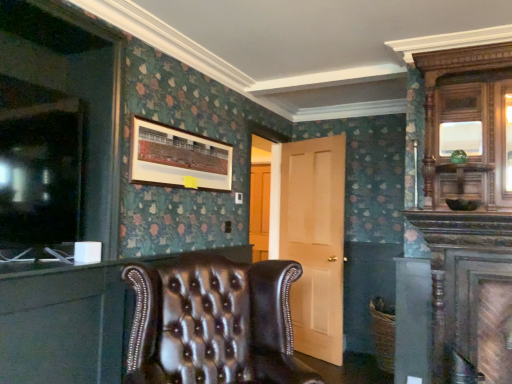
What do you see at coordinates (213, 323) in the screenshot? This screenshot has height=384, width=512. I see `leather tufted chair at center` at bounding box center [213, 323].

Find the location of a particular element. The image size is (512, 384). leather tufted chair at lower left is located at coordinates (67, 323).

Measure the distance between light wood door at center and camera.

The depth of light wood door at center is 3.57 meters.

This screenshot has height=384, width=512. Describe the element at coordinates (452, 73) in the screenshot. I see `polished wood armoire at upper right` at that location.

The image size is (512, 384). What are the coordinates of `leather tufted chair at center` in the screenshot? It's located at (213, 323).

Is polished wood armoire at upper right touching leather tufted chair at lower left?

polished wood armoire at upper right and leather tufted chair at lower left are clearly separated.

Is polished wood armoire at upper right wider than leather tufted chair at lower left?

Correct, the width of polished wood armoire at upper right exceeds that of leather tufted chair at lower left.

You are a GUI agent. You are given a task and a screenshot of the screen. Output one action in this format:
    pyautogui.click(x=<x>, y=<y>)
    Task: Click on the dresser that is under the polished wood armoire at upper right (from a real-world perspective)
    
    Given the screenshot: What is the action you would take?
    pyautogui.click(x=67, y=323)

From a real-world perspective, relative to leather tufted chair at lower left, is polished wood armoire at upper right vertically above or below?

Clearly, from a real-world perspective, polished wood armoire at upper right is above leather tufted chair at lower left.

Is leather tufted chair at center not within matte wooden picture frame at upper center?

Absolutely, leather tufted chair at center is external to matte wooden picture frame at upper center.

Is leather tufted chair at center at the left side of matte wooden picture frame at upper center?

Incorrect, leather tufted chair at center is not on the left side of matte wooden picture frame at upper center.

Which object is thinner, leather tufted chair at center or matte wooden picture frame at upper center?

matte wooden picture frame at upper center is thinner.

Where is `chair below the matte wooden picture frame at upper center (from a real-world perspective)`? chair below the matte wooden picture frame at upper center (from a real-world perspective) is located at coordinates (213, 323).

From the image's perspective, which is below, matte wooden picture frame at upper center or leather tufted chair at center?

leather tufted chair at center is shown below in the image.

How distant is matte wooden picture frame at upper center from leather tufted chair at center?

They are 31.71 inches apart.

What's the angular difference between leather tufted chair at lower left and polished wood armoire at upper right's facing directions?

The angle between the facing direction of leather tufted chair at lower left and the facing direction of polished wood armoire at upper right is 88.9 degrees.

Does leather tufted chair at lower left have a smaller size compared to polished wood armoire at upper right?

Yes.

Is leather tufted chair at lower left looking in the opposite direction of polished wood armoire at upper right?

That's not correct — leather tufted chair at lower left is not looking away from polished wood armoire at upper right.

Which of these two, leather tufted chair at lower left or polished wood armoire at upper right, stands shorter?

leather tufted chair at lower left.

From the picture: Would you say leather tufted chair at center is outside polished wood armoire at upper right?

leather tufted chair at center lies outside polished wood armoire at upper right's area.

Considering the relative sizes of leather tufted chair at center and polished wood armoire at upper right in the image provided, is leather tufted chair at center smaller than polished wood armoire at upper right?

No.

Which is in front, point (131, 344) or point (426, 58)?

The point (131, 344) is closer to the camera.

I want to click on armoire to the right of leather tufted chair at center, so click(452, 73).

Can you confirm if light wood door at center is taller than leather tufted chair at center?

Yes.

Considering the sizes of light wood door at center and leather tufted chair at center in the image, is light wood door at center bigger or smaller than leather tufted chair at center?

Clearly, light wood door at center is smaller in size than leather tufted chair at center.

How many degrees apart are the facing directions of light wood door at center and leather tufted chair at center?

They differ by 69.6 degrees in their facing directions.

Is leather tufted chair at center at the back of light wood door at center?

No, light wood door at center is not facing the opposite direction of leather tufted chair at center.

Considering their positions, is leather tufted chair at lower left located in front of or behind leather tufted chair at center?

Clearly, leather tufted chair at lower left is behind leather tufted chair at center.

From the image's perspective, which is below, leather tufted chair at lower left or leather tufted chair at center?

leather tufted chair at center.

Where is `armoire located above the leather tufted chair at lower left (from a real-world perspective)`? Image resolution: width=512 pixels, height=384 pixels. armoire located above the leather tufted chair at lower left (from a real-world perspective) is located at coordinates (452, 73).

This screenshot has width=512, height=384. Find the location of `chair located below the matte wooden picture frame at upper center (from the image's perspective)`. chair located below the matte wooden picture frame at upper center (from the image's perspective) is located at coordinates (213, 323).

Based on their spatial positions, is leather tufted chair at lower left or matte wooden picture frame at upper center further from light wood door at center?

leather tufted chair at lower left.

When comparing their distances from leather tufted chair at center, does leather tufted chair at lower left or light wood door at center seem closer?

Among the two, leather tufted chair at lower left is located nearer to leather tufted chair at center.

Based on the photo, looking at the image, which one is located further to leather tufted chair at center, polished wood armoire at upper right or light wood door at center?

light wood door at center lies further to leather tufted chair at center than the other object.

Estimate the real-world distances between objects in this image. Which object is closer to leather tufted chair at lower left, polished wood armoire at upper right or matte wooden picture frame at upper center?

matte wooden picture frame at upper center is closer to leather tufted chair at lower left.

Looking at the image, which one is located closer to light wood door at center, matte wooden picture frame at upper center or leather tufted chair at lower left?

matte wooden picture frame at upper center lies closer to light wood door at center than the other object.

Based on their spatial positions, is polished wood armoire at upper right or leather tufted chair at center closer to leather tufted chair at lower left?

Based on the image, leather tufted chair at center appears to be nearer to leather tufted chair at lower left.

From the image, which object appears to be nearer to matte wooden picture frame at upper center, leather tufted chair at center or light wood door at center?

leather tufted chair at center is positioned closer to the anchor matte wooden picture frame at upper center.

Which object lies further to the anchor point polished wood armoire at upper right, light wood door at center or leather tufted chair at lower left?

Based on the image, leather tufted chair at lower left appears to be further to polished wood armoire at upper right.

Find the location of a particular element. The height and width of the screenshot is (384, 512). picture frame between leather tufted chair at lower left and light wood door at center in the front-back direction is located at coordinates (178, 158).

Where is `picture frame between leather tufted chair at lower left and polished wood armoire at upper right from left to right`? This screenshot has height=384, width=512. picture frame between leather tufted chair at lower left and polished wood armoire at upper right from left to right is located at coordinates (178, 158).

The height and width of the screenshot is (384, 512). In order to click on dresser between matte wooden picture frame at upper center and leather tufted chair at center from top to bottom in this screenshot , I will do `click(67, 323)`.

Where is `chair between matte wooden picture frame at upper center and polished wood armoire at upper right in the horizontal direction`? chair between matte wooden picture frame at upper center and polished wood armoire at upper right in the horizontal direction is located at coordinates (213, 323).